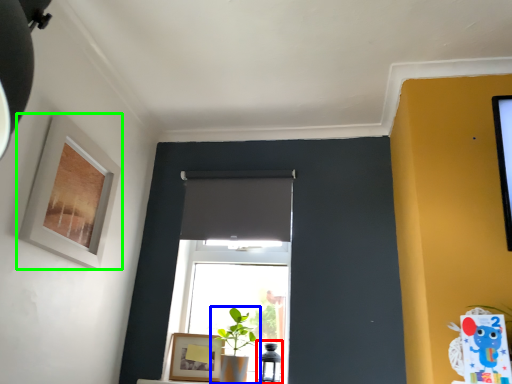
Question: Based on their relative distances, which object is nearer to table lamp (highlighted by a red box)? Choose from houseplant (highlighted by a blue box) and picture frame (highlighted by a green box).

Choices:
 (A) houseplant
 (B) picture frame

Answer: (A)